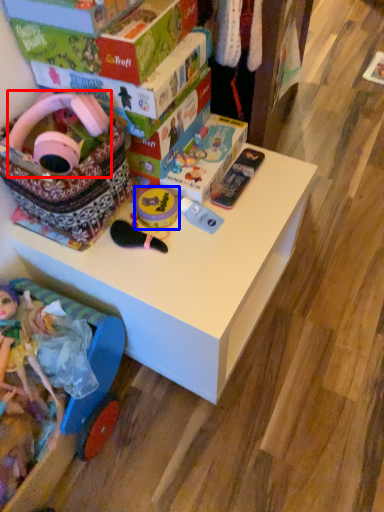
Question: Among these objects, which one is nearest to the camera, toy (highlighted by a red box) or toy (highlighted by a blue box)?

Choices:
 (A) toy
 (B) toy

Answer: (A)